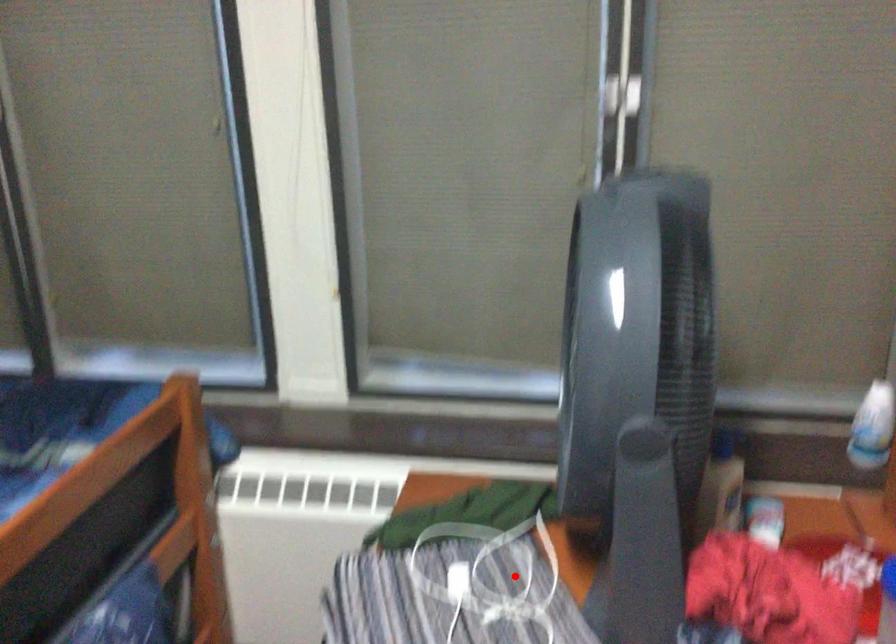
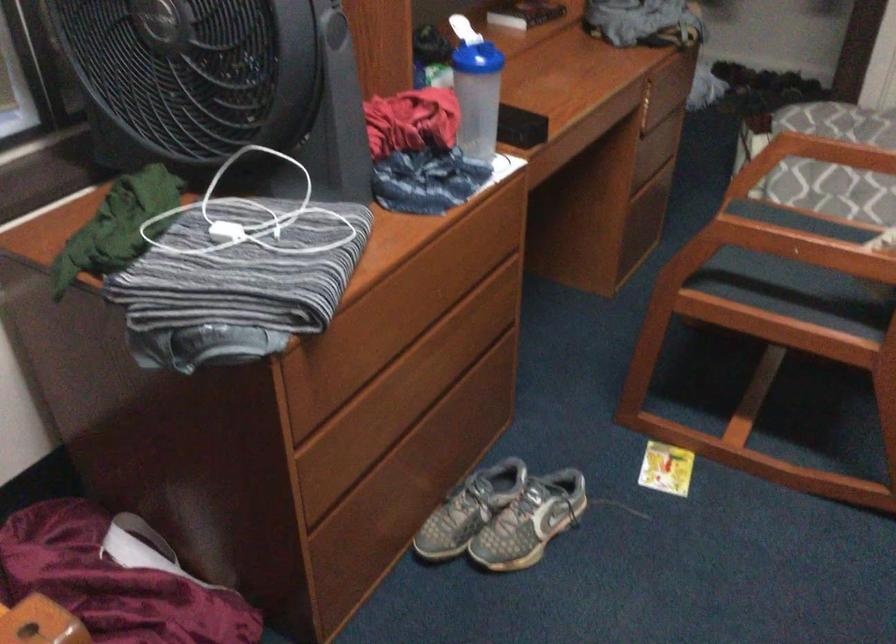
Where in the second image is the point corresponding to the highlighted location from the first image?

(250, 216)